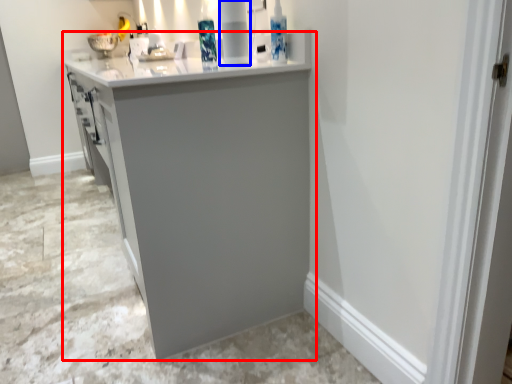
Question: Which object is closer to the camera taking this photo, cabinetry (highlighted by a red box) or appliance (highlighted by a blue box)?

Choices:
 (A) cabinetry
 (B) appliance

Answer: (A)